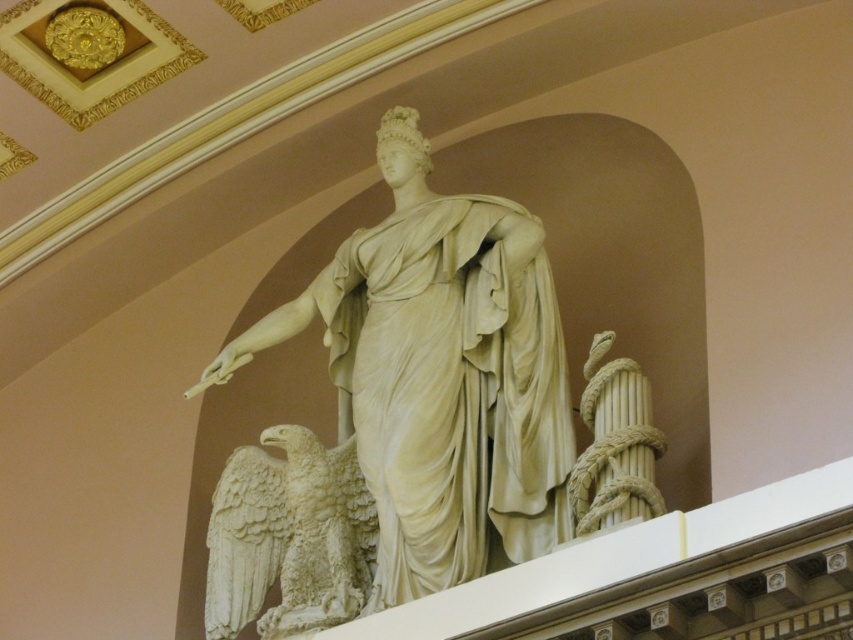
You are an art student analyzing the composition of the sculpture. You notice the white marble statue at center and the white marble eagle at lower left. Which object is positioned to the right of the other?

The white marble statue at center is to the right of the white marble eagle at lower left.

You are an art conservator assessing the placement of the white marble statue at center and the white marble eagle at lower left. Based on the statue and eagle positions, which object is higher in elevation?

The white marble statue at center is positioned over the white marble eagle at lower left, so it is higher in elevation.